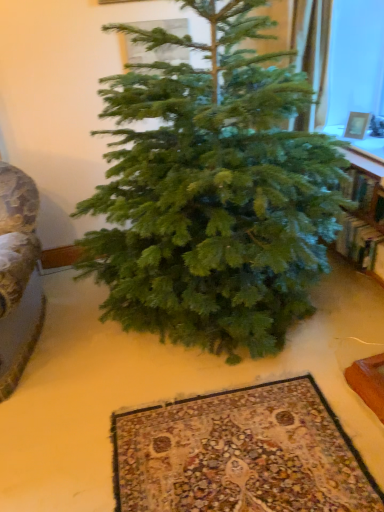
Locate an element on the screen. This screenshot has height=512, width=384. green matte christmas tree at center is located at coordinates (212, 193).

What do you see at coordinates (212, 193) in the screenshot? Image resolution: width=384 pixels, height=512 pixels. I see `green matte christmas tree at center` at bounding box center [212, 193].

Identify the location of green matte christmas tree at center. Image resolution: width=384 pixels, height=512 pixels. (212, 193).